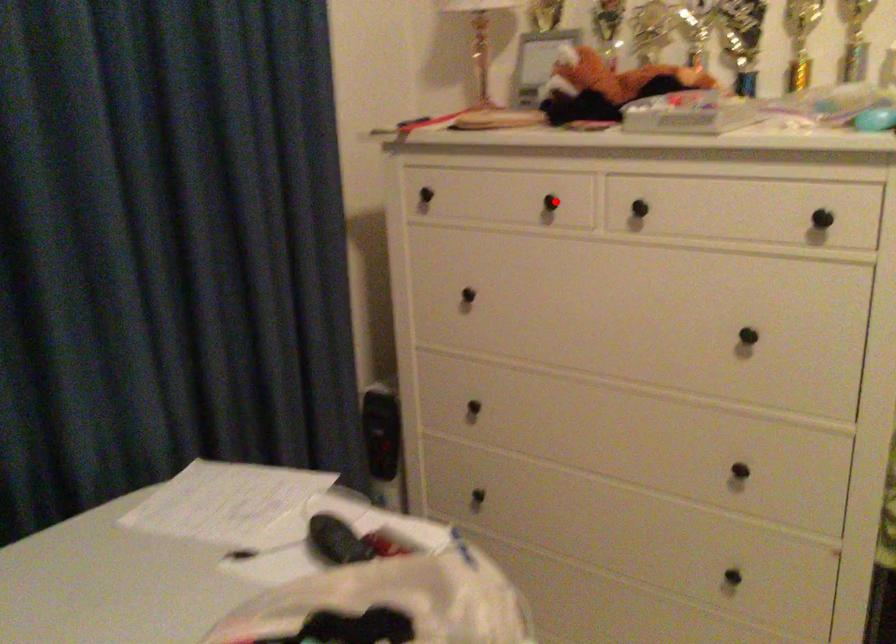
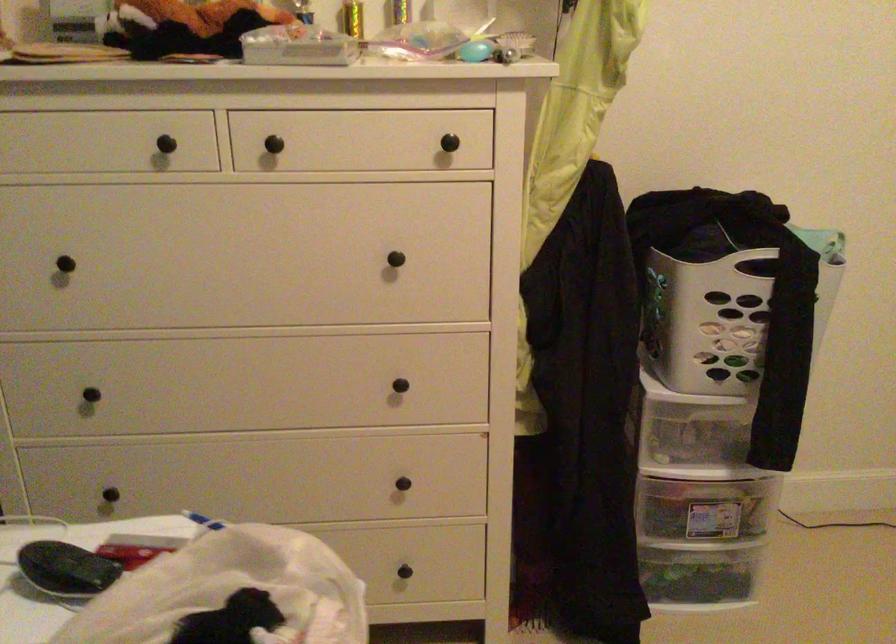
Question: I am providing you with two images of the same scene from different viewpoints. A red point is marked on the first image. Can you still see the location of the red point in image 2?

Choices:
 (A) Yes
 (B) No

Answer: (A)